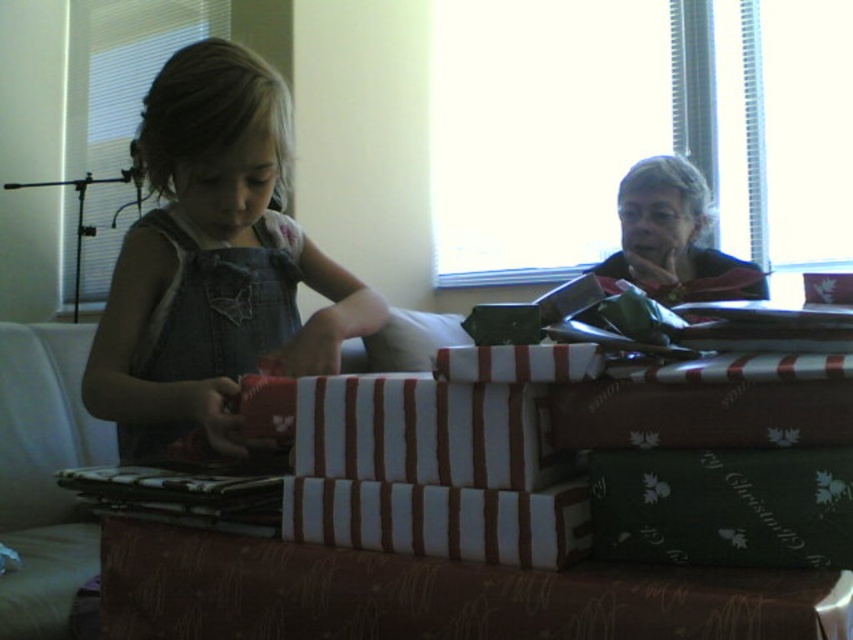
Question: Is denim overalls at center smaller than matte denim dress at left?

Choices:
 (A) no
 (B) yes

Answer: (A)

Question: Is denim overalls at center below matte denim dress at left?

Choices:
 (A) no
 (B) yes

Answer: (A)

Question: Which point is closer to the camera taking this photo?

Choices:
 (A) (204, 93)
 (B) (152, 333)

Answer: (A)

Question: Does denim overalls at center have a smaller size compared to matte denim dress at left?

Choices:
 (A) yes
 (B) no

Answer: (B)